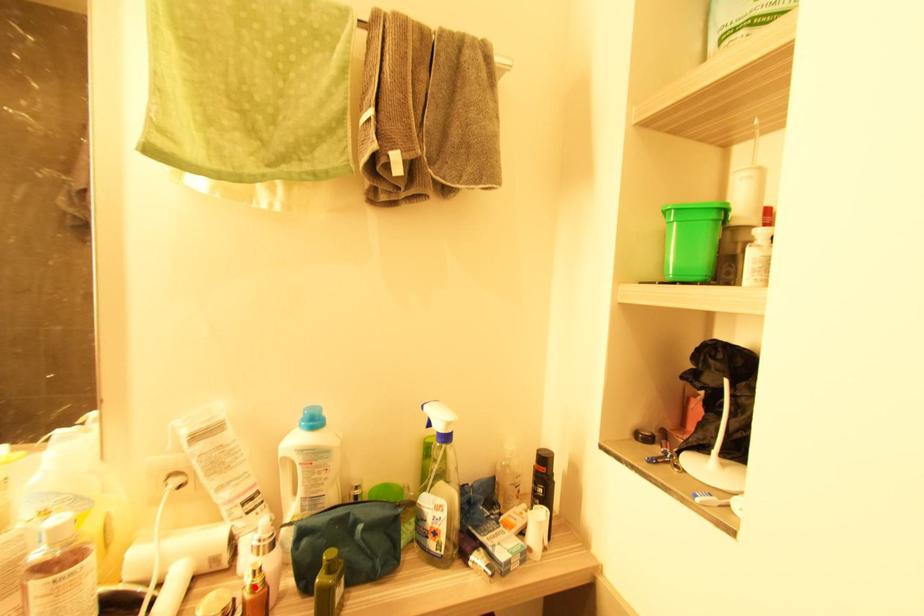
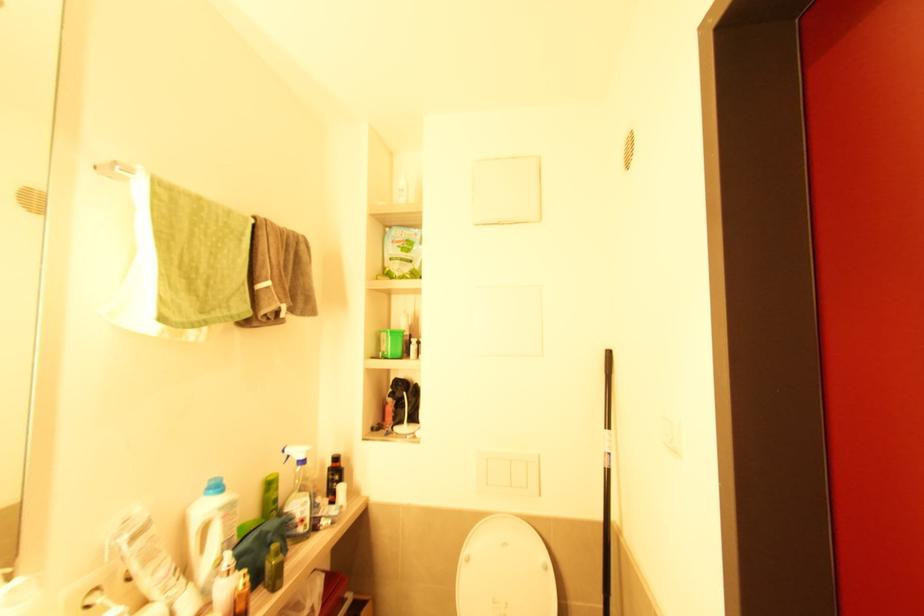
The point at the highlighted location is marked in the first image. Where is the corresponding point in the second image?

(247, 585)